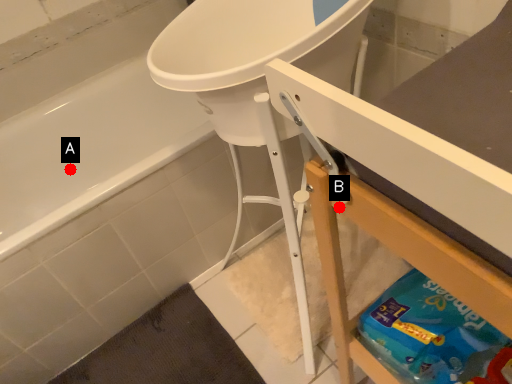
Question: Two points are circled on the image, labeled by A and B beside each circle. Which point appears closest to the camera in this image?

Choices:
 (A) A is closer
 (B) B is closer

Answer: (B)